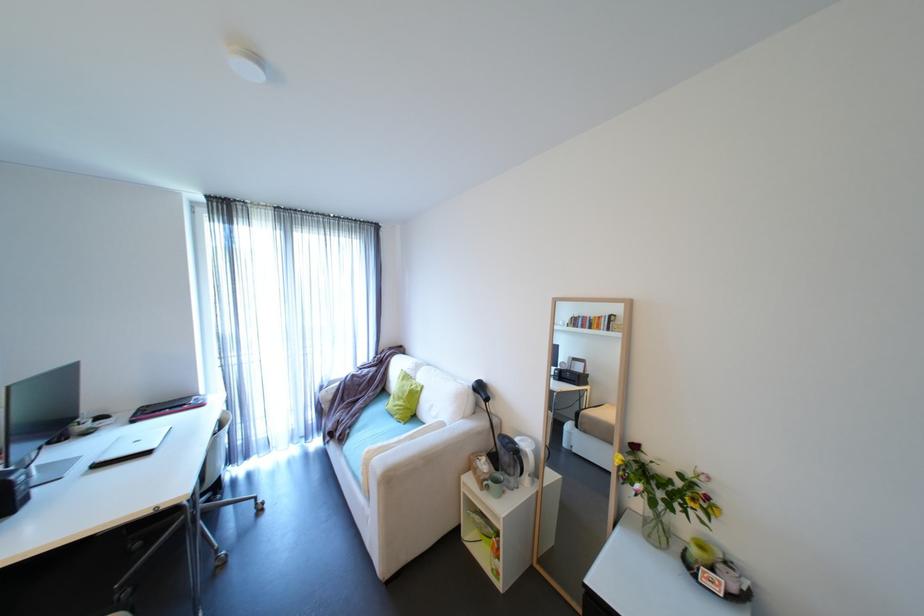
The image size is (924, 616). What do you see at coordinates (434, 445) in the screenshot? I see `the white sofa armrest` at bounding box center [434, 445].